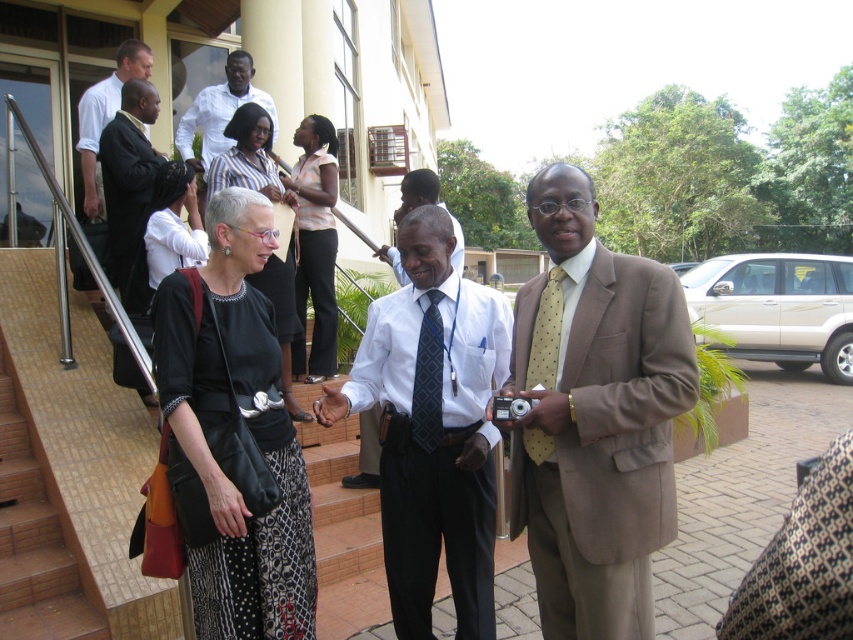
Question: Which of the following is the farthest from the observer?

Choices:
 (A) (318, 227)
 (B) (438, 320)

Answer: (A)

Question: Is matte pink blouse at center above matte black dress at center?

Choices:
 (A) no
 (B) yes

Answer: (A)

Question: Which point is farther to the camera?

Choices:
 (A) (306, 548)
 (B) (225, 84)

Answer: (B)

Question: From the image, what is the correct spatial relationship of matte pink blouse at center in relation to yellow dotted tie at center?

Choices:
 (A) left
 (B) right

Answer: (A)

Question: Can you confirm if black suit at upper left is positioned to the left of black satin dress at center?

Choices:
 (A) no
 (B) yes

Answer: (B)

Question: Estimate the real-world distances between objects in this image. Which object is farther from the matte black dress at center?

Choices:
 (A) white shirt at upper center
 (B) dark blue textured tie at center
 (C) brown tile stairs at lower left
 (D) matte pink blouse at center

Answer: (B)